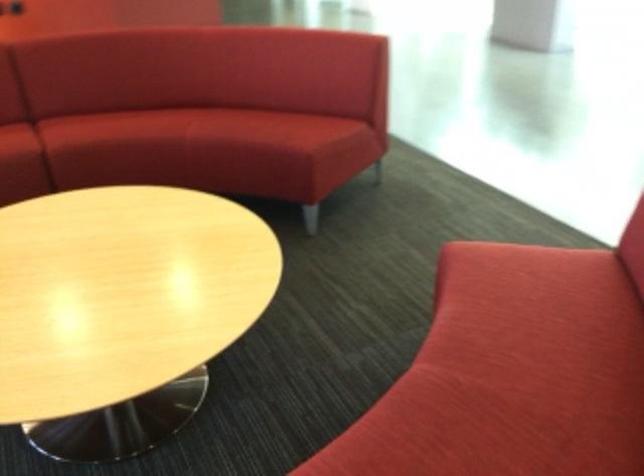
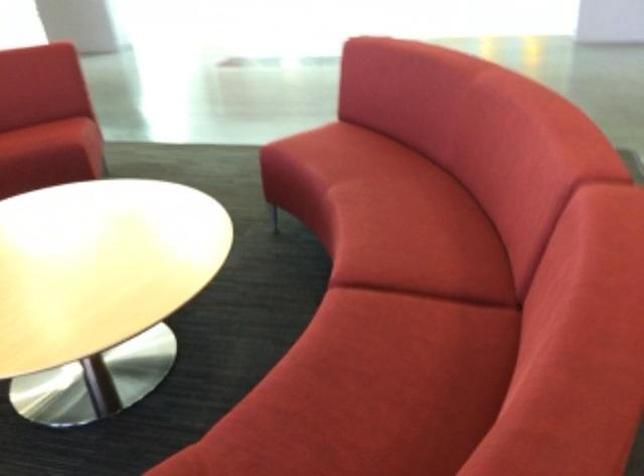
The point at (288, 129) is marked in the first image. Where is the corresponding point in the second image?

(46, 136)